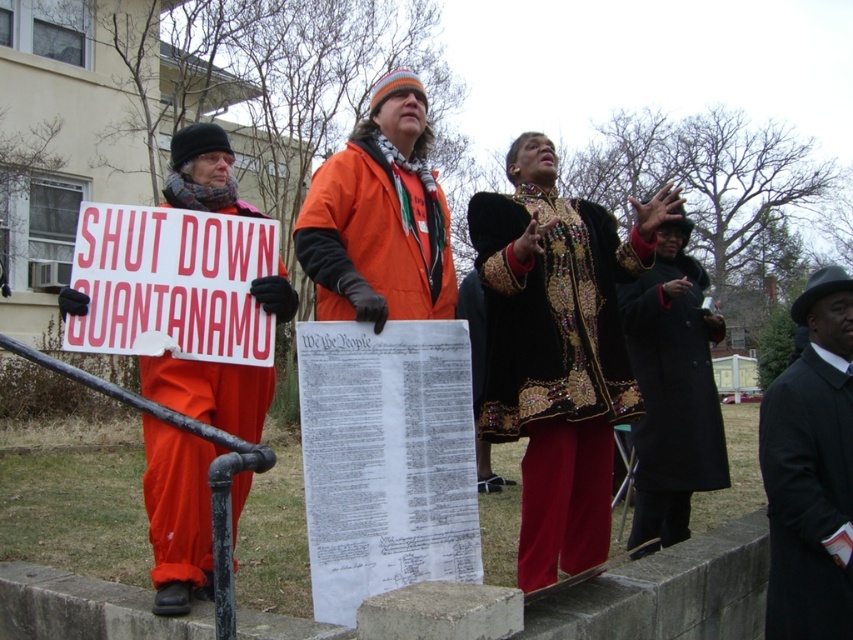
Question: Can you confirm if velvet black robe at center is positioned to the right of red plastic sign at center?

Choices:
 (A) yes
 (B) no

Answer: (A)

Question: Which of these objects is positioned closest to the velvet black robe at center?

Choices:
 (A) black wool coat at right
 (B) red plastic sign at center
 (C) black fur coat at center

Answer: (C)

Question: Which object is closer to the camera taking this photo?

Choices:
 (A) black fur coat at center
 (B) velvet black robe at center

Answer: (B)

Question: Observing the image, what is the correct spatial positioning of black wool coat at right in reference to black fur coat at center?

Choices:
 (A) right
 (B) left

Answer: (A)

Question: Observing the image, what is the correct spatial positioning of red plastic sign at center in reference to black wool coat at right?

Choices:
 (A) right
 (B) left

Answer: (B)

Question: Which object is closer to the camera taking this photo?

Choices:
 (A) velvet black robe at center
 (B) black fur coat at center
 (C) red plastic sign at center
 (D) black wool coat at right

Answer: (D)